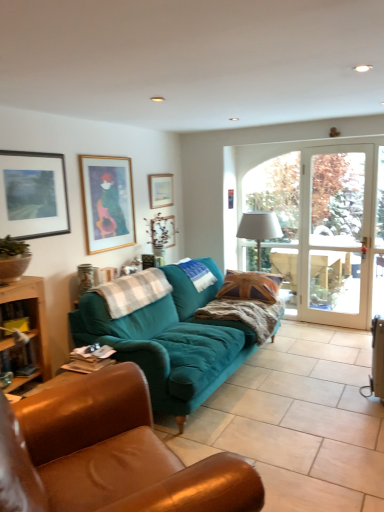
The height and width of the screenshot is (512, 384). What do you see at coordinates (250, 286) in the screenshot?
I see `union jack fabric pillow at center` at bounding box center [250, 286].

Describe the element at coordinates (259, 229) in the screenshot. I see `white fabric lampshade at center` at that location.

How much space does teal fabric couch at center, which appears as the first studio couch when viewed from the back, occupy vertically?

90.96 centimeters.

Image resolution: width=384 pixels, height=512 pixels. Identify the location of teal fabric couch at center, acting as the second studio couch starting from the front. (170, 341).

Identify the location of matte black picture frame at upper left, which appears as the fourth picture frame when viewed from the back. The height and width of the screenshot is (512, 384). (33, 195).

This screenshot has width=384, height=512. Find the location of `teal fabric couch at center, the 2th studio couch in the back-to-front sequence`. teal fabric couch at center, the 2th studio couch in the back-to-front sequence is located at coordinates (109, 454).

From the image's perspective, which object appears higher, brown leather table at lower left or teal fabric couch at center, which appears as the first studio couch when viewed from the back?

brown leather table at lower left appears higher in the image.

Is brown leather table at lower left aimed at teal fabric couch at center, which appears as the first studio couch when viewed from the back?

No, brown leather table at lower left does not turn towards teal fabric couch at center, which appears as the first studio couch when viewed from the back.

Considering the sizes of objects brown leather table at lower left and teal fabric couch at center, acting as the second studio couch starting from the front, in the image provided, who is shorter, brown leather table at lower left or teal fabric couch at center, acting as the second studio couch starting from the front,?

Standing shorter between the two is brown leather table at lower left.

In terms of width, does brown leather table at lower left look wider or thinner when compared to teal fabric couch at center, acting as the second studio couch starting from the front?

In the image, brown leather table at lower left appears to be more narrow than teal fabric couch at center, acting as the second studio couch starting from the front.

Does wooden picture frame at upper center, positioned as the second picture frame in right-to-left order, have a lesser width compared to white glass door at right?

Indeed, wooden picture frame at upper center, positioned as the second picture frame in right-to-left order, has a lesser width compared to white glass door at right.

Could you measure the distance between wooden picture frame at upper center, acting as the 3th picture frame starting from the left, and white glass door at right?

6.46 feet.

Relative to white glass door at right, is wooden picture frame at upper center, positioned as the second picture frame in right-to-left order, in front or behind?

wooden picture frame at upper center, positioned as the second picture frame in right-to-left order, is behind white glass door at right.

Looking at this image, considering the positions of objects wooden picture frame at upper center, acting as the 3th picture frame starting from the left, and white glass door at right in the image provided, who is more to the right, wooden picture frame at upper center, acting as the 3th picture frame starting from the left, or white glass door at right?

From the viewer's perspective, white glass door at right appears more on the right side.

Which object is closer to the camera taking this photo, gold-framed picture at upper left, the third picture frame when ordered from back to front, or metallic silver picture frame at upper center, placed as the 1th picture frame when sorted from right to left?

gold-framed picture at upper left, the third picture frame when ordered from back to front, is more forward.

Considering the relative positions of gold-framed picture at upper left, the 2th picture frame when ordered from front to back, and metallic silver picture frame at upper center, which ranks as the 4th picture frame in left-to-right order, in the image provided, is gold-framed picture at upper left, the 2th picture frame when ordered from front to back, to the left of metallic silver picture frame at upper center, which ranks as the 4th picture frame in left-to-right order, from the viewer's perspective?

Correct, you'll find gold-framed picture at upper left, the 2th picture frame when ordered from front to back, to the left of metallic silver picture frame at upper center, which ranks as the 4th picture frame in left-to-right order.

Is gold-framed picture at upper left, acting as the second picture frame starting from the left, inside or outside of metallic silver picture frame at upper center, the 4th picture frame when ordered from front to back?

gold-framed picture at upper left, acting as the second picture frame starting from the left, is located beyond the bounds of metallic silver picture frame at upper center, the 4th picture frame when ordered from front to back.

Can you see gold-framed picture at upper left, marked as the 3th picture frame in a right-to-left arrangement, touching metallic silver picture frame at upper center, which ranks as the 4th picture frame in left-to-right order?

They are not placed beside each other.

This screenshot has height=512, width=384. I want to click on pillow above the teal fabric couch at center, the 2th studio couch in the back-to-front sequence (from a real-world perspective), so click(250, 286).

Is teal fabric couch at center, positioned as the first studio couch in front-to-back order, oriented towards union jack fabric pillow at center?

No, teal fabric couch at center, positioned as the first studio couch in front-to-back order, is not aimed at union jack fabric pillow at center.

How much distance is there between teal fabric couch at center, the 2th studio couch in the back-to-front sequence, and union jack fabric pillow at center?

teal fabric couch at center, the 2th studio couch in the back-to-front sequence, and union jack fabric pillow at center are 7.56 feet apart from each other.

From the image's perspective, between teal fabric couch at center, the 2th studio couch in the back-to-front sequence, and union jack fabric pillow at center, who is located below?

teal fabric couch at center, the 2th studio couch in the back-to-front sequence.

Considering the relative positions of matte black picture frame at upper left, the first picture frame viewed from the left, and teal fabric couch at center, which appears as the first studio couch when viewed from the back, in the image provided, is matte black picture frame at upper left, the first picture frame viewed from the left, to the left or to the right of teal fabric couch at center, which appears as the first studio couch when viewed from the back,?

Clearly, matte black picture frame at upper left, the first picture frame viewed from the left, is on the left of teal fabric couch at center, which appears as the first studio couch when viewed from the back, in the image.

From a real-world perspective, which is physically below, matte black picture frame at upper left, the first picture frame viewed from the left, or teal fabric couch at center, which appears as the first studio couch when viewed from the back?

In real-world perspective, teal fabric couch at center, which appears as the first studio couch when viewed from the back, is lower.

Is there a large distance between matte black picture frame at upper left, the first picture frame viewed from the left, and teal fabric couch at center, acting as the second studio couch starting from the front?

Yes, matte black picture frame at upper left, the first picture frame viewed from the left, and teal fabric couch at center, acting as the second studio couch starting from the front, are located far from each other.

Which object is closer to the camera, matte black picture frame at upper left, which appears as the fourth picture frame when viewed from the back, or teal fabric couch at center, acting as the second studio couch starting from the front?

Positioned in front is teal fabric couch at center, acting as the second studio couch starting from the front.

Which object is wider, brown leather table at lower left or metallic silver picture frame at upper center, placed as the 1th picture frame when sorted from right to left?

With larger width is brown leather table at lower left.

From the image's perspective, is brown leather table at lower left above or below metallic silver picture frame at upper center, placed as the first picture frame when sorted from back to front?

Clearly, from the image's perspective, brown leather table at lower left is below metallic silver picture frame at upper center, placed as the first picture frame when sorted from back to front.

Considering the positions of points (5, 302) and (159, 220), is point (5, 302) closer to camera compared to point (159, 220)?

Yes.

Which is more to the right, white fabric lampshade at center or teal fabric couch at center, acting as the second studio couch starting from the front?

Positioned to the right is white fabric lampshade at center.

Is white fabric lampshade at center looking in the opposite direction of teal fabric couch at center, acting as the second studio couch starting from the front?

That's not correct — white fabric lampshade at center is not looking away from teal fabric couch at center, acting as the second studio couch starting from the front.

Where is `lamp above the teal fabric couch at center, which appears as the first studio couch when viewed from the back (from a real-world perspective)`? This screenshot has height=512, width=384. lamp above the teal fabric couch at center, which appears as the first studio couch when viewed from the back (from a real-world perspective) is located at coordinates (259, 229).

Would you say white fabric lampshade at center is outside teal fabric couch at center, which appears as the first studio couch when viewed from the back?

white fabric lampshade at center lies outside teal fabric couch at center, which appears as the first studio couch when viewed from the back,'s area.

Locate an element on the screen. The image size is (384, 512). table that is in front of the teal fabric couch at center, acting as the second studio couch starting from the front is located at coordinates (31, 324).

From the image's perspective, which picture frame is the 4th one above the white glass door at right? Please provide its 2D coordinates.

[(160, 190)]

Based on their spatial positions, is brown leather table at lower left or teal fabric couch at center, positioned as the first studio couch in front-to-back order, further from metallic silver picture frame at upper center, the 4th picture frame when ordered from front to back?

Based on the image, teal fabric couch at center, positioned as the first studio couch in front-to-back order, appears to be further to metallic silver picture frame at upper center, the 4th picture frame when ordered from front to back.

From the image, which object appears to be farther from wooden picture frame at upper center, the second picture frame viewed from the back, brown leather table at lower left or teal fabric couch at center, the 2th studio couch in the back-to-front sequence?

The object further to wooden picture frame at upper center, the second picture frame viewed from the back, is teal fabric couch at center, the 2th studio couch in the back-to-front sequence.

Which object lies nearer to the anchor point metallic silver picture frame at upper center, the 4th picture frame when ordered from front to back, wooden picture frame at upper center, acting as the third picture frame starting from the front, or teal fabric couch at center, which appears as the first studio couch when viewed from the back?

The object closer to metallic silver picture frame at upper center, the 4th picture frame when ordered from front to back, is wooden picture frame at upper center, acting as the third picture frame starting from the front.

When comparing their distances from white fabric lampshade at center, does teal fabric couch at center, acting as the second studio couch starting from the front, or brown leather table at lower left seem further?

brown leather table at lower left is positioned further to the anchor white fabric lampshade at center.

Estimate the real-world distances between objects in this image. Which object is closer to brown leather table at lower left, metallic silver picture frame at upper center, placed as the first picture frame when sorted from back to front, or gold-framed picture at upper left, the third picture frame when ordered from back to front?

Among the two, gold-framed picture at upper left, the third picture frame when ordered from back to front, is located nearer to brown leather table at lower left.

Looking at the image, which one is located closer to teal fabric couch at center, acting as the second studio couch starting from the front, white glass door at right or union jack fabric pillow at center?

Among the two, union jack fabric pillow at center is located nearer to teal fabric couch at center, acting as the second studio couch starting from the front.

From the image, which object appears to be nearer to white fabric lampshade at center, union jack fabric pillow at center or teal fabric couch at center, acting as the second studio couch starting from the front?

union jack fabric pillow at center is positioned closer to the anchor white fabric lampshade at center.

When comparing their distances from white glass door at right, does wooden picture frame at upper center, positioned as the second picture frame in right-to-left order, or teal fabric couch at center, which appears as the first studio couch when viewed from the back, seem closer?

Among the two, teal fabric couch at center, which appears as the first studio couch when viewed from the back, is located nearer to white glass door at right.

Find the location of a particular element. pillow between wooden picture frame at upper center, the second picture frame viewed from the back, and white glass door at right, in the horizontal direction is located at coordinates (250, 286).

Locate an element on the screen. This screenshot has height=512, width=384. pillow located between brown leather table at lower left and white fabric lampshade at center in the depth direction is located at coordinates (250, 286).

Identify the location of lamp between wooden picture frame at upper center, the second picture frame viewed from the back, and white glass door at right. pos(259,229).

At what (x,y) coordinates should I click in order to perform the action: click on lamp located between teal fabric couch at center, acting as the second studio couch starting from the front, and metallic silver picture frame at upper center, the 4th picture frame when ordered from front to back, in the depth direction. Please return your answer as a coordinate pair (x, y). This screenshot has width=384, height=512. Looking at the image, I should click on (259, 229).